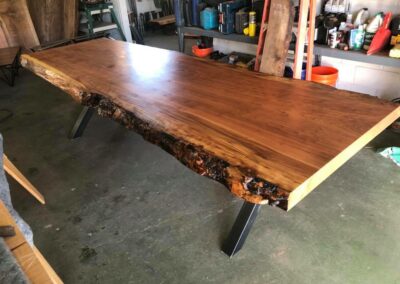
You are a GUI agent. You are given a task and a screenshot of the screen. Output one action in this format:
    pyautogui.click(x=<x>, y=<y>)
    Task: Click on the step stool
    The width and height of the screenshot is (400, 284).
    Given the screenshot: What is the action you would take?
    pyautogui.click(x=103, y=27)